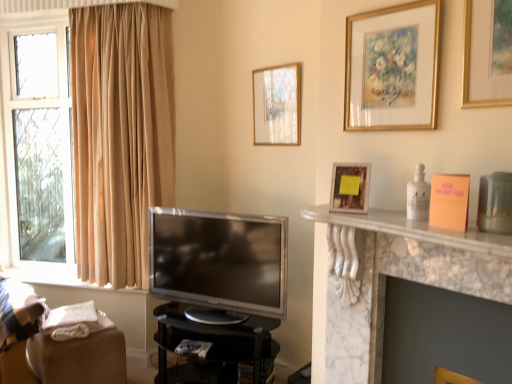
Question: From the image's perspective, relative to matte plastic book at lower center, is matte gold picture frame at upper center, the third picture frame positioned from the front, above or below?

Choices:
 (A) below
 (B) above

Answer: (B)

Question: Do you think matte gold picture frame at upper center, which ranks as the first picture frame in back-to-front order, is within matte plastic book at lower center, or outside of it?

Choices:
 (A) outside
 (B) inside

Answer: (A)

Question: Which object is the closest to the matte plastic book at lower center?

Choices:
 (A) matte gold picture frame at upper center, marked as the 1th picture frame in a left-to-right arrangement
 (B) white marble fireplace at right
 (C) white marble fireplace at right
 (D) satin silver television at center
 (E) gold-framed painting at upper center, positioned as the third picture frame in back-to-front order

Answer: (D)

Question: Estimate the real-world distances between objects in this image. Which object is farther from the brown fabric swivel chair at lower left?

Choices:
 (A) matte gold picture frame at upper center, the third picture frame positioned from the front
 (B) white marble fireplace at right
 (C) satin silver television at center
 (D) black glossy tv stand at lower center
 (E) wooden photo frame at upper right, arranged as the second picture frame when viewed from the front

Answer: (A)